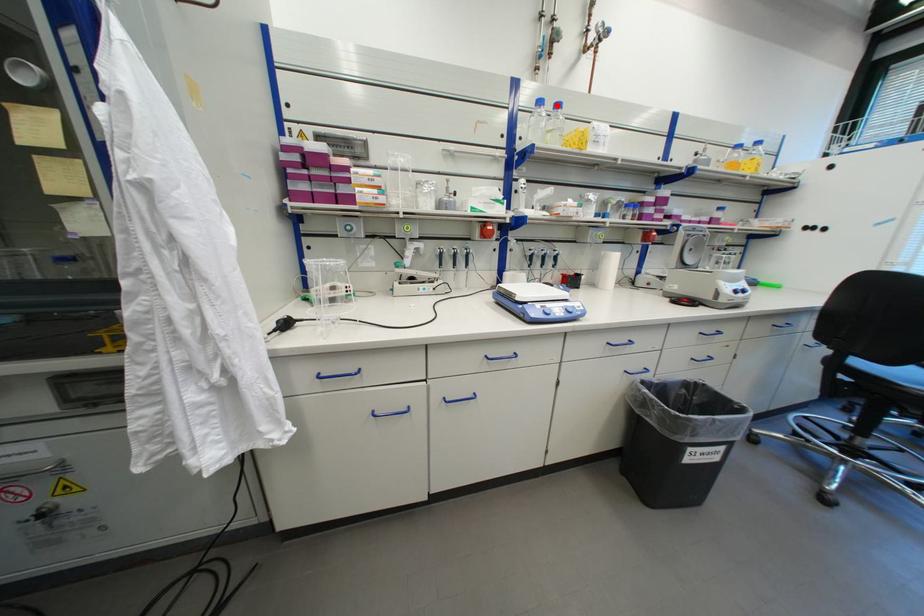
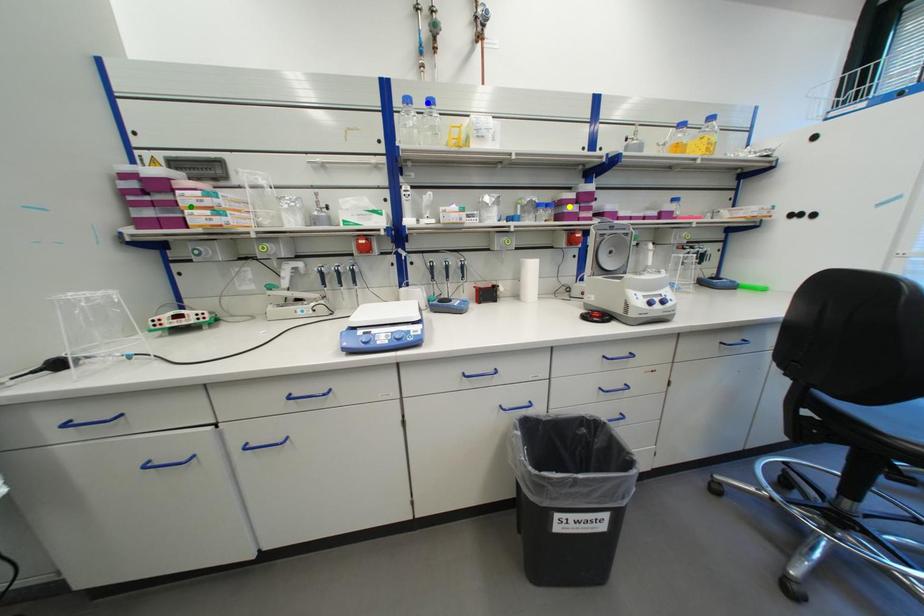
Question: I am providing you with two images of the same scene from different viewpoints. A red point is marked on the first image. You are given multiple points on the second image. Which point in image 2 represents the same 3d spot as the red point in image 1?

Choices:
 (A) blue point
 (B) yellow point
 (C) green point

Answer: (A)